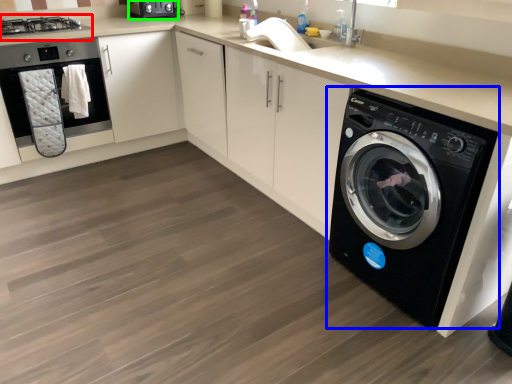
Question: Estimate the real-world distances between objects in this image. Which object is closer to stove (highlighted by a red box), washing machine (highlighted by a blue box) or appliance (highlighted by a green box)?

Choices:
 (A) washing machine
 (B) appliance

Answer: (B)